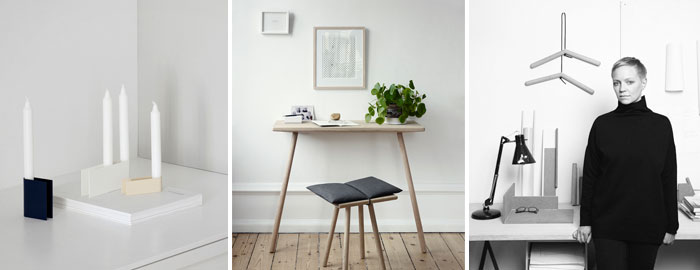
You are a GUI agent. You are given a task and a screenshot of the screen. Output one action in this format:
    pyautogui.click(x=<x>, y=<y>)
    Task: Click on the plant
    This screenshot has width=700, height=270.
    Given the screenshot: What is the action you would take?
    (x=397, y=119)